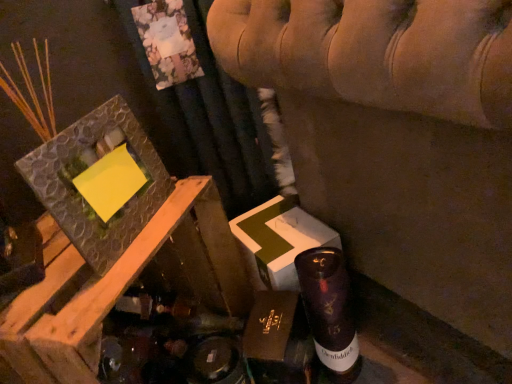
Measure the distance between point (x=48, y=179) and camera.

A distance of 22.09 inches exists between point (x=48, y=179) and camera.

Where is `textured stone picture frame at upper left`? This screenshot has height=384, width=512. textured stone picture frame at upper left is located at coordinates (79, 194).

From the image's perspective, which is below, textured stone picture frame at upper left or velvet beige sofa at upper center?

textured stone picture frame at upper left is shown below in the image.

Which is behind, textured stone picture frame at upper left or velvet beige sofa at upper center?

textured stone picture frame at upper left is more distant.

From the picture: Is textured stone picture frame at upper left at the left side of velvet beige sofa at upper center?

Indeed, textured stone picture frame at upper left is positioned on the left side of velvet beige sofa at upper center.

Consider the image. Who is shorter, textured stone picture frame at upper left or velvet beige sofa at upper center?

With less height is textured stone picture frame at upper left.

Consider the image. Can we say textured stone picture frame at upper left lies outside brown cardboard box at center?

Yes, textured stone picture frame at upper left is located beyond the bounds of brown cardboard box at center.

Is textured stone picture frame at upper left looking in the opposite direction of brown cardboard box at center?

No, textured stone picture frame at upper left is not facing the opposite direction of brown cardboard box at center.

From the image's perspective, which one is positioned lower, textured stone picture frame at upper left or brown cardboard box at center?

From the image's view, brown cardboard box at center is below.

Is textured stone picture frame at upper left to the left of brown cardboard box at center from the viewer's perspective?

Correct, you'll find textured stone picture frame at upper left to the left of brown cardboard box at center.

Measure the distance from shiny purple glass bottle at lower right to velvet beige sofa at upper center.

shiny purple glass bottle at lower right and velvet beige sofa at upper center are 9.40 inches apart from each other.

You are a GUI agent. You are given a task and a screenshot of the screen. Output one action in this format:
    pyautogui.click(x=<x>, y=<y>)
    Task: Click on the bottle behind the velvet beige sofa at upper center
    
    Given the screenshot: What is the action you would take?
    pyautogui.click(x=330, y=311)

Can you confirm if shiny purple glass bottle at lower right is wider than velvet beige sofa at upper center?

In fact, shiny purple glass bottle at lower right might be narrower than velvet beige sofa at upper center.

Does shiny purple glass bottle at lower right turn towards velvet beige sofa at upper center?

Yes, shiny purple glass bottle at lower right is facing velvet beige sofa at upper center.

Based on the photo, does velvet beige sofa at upper center lie in front of shiny purple glass bottle at lower right?

Yes.

Locate an element on the screen. bottle on the left of the velvet beige sofa at upper center is located at coordinates (330, 311).

Are velvet beige sofa at upper center and shiny purple glass bottle at lower right making contact?

velvet beige sofa at upper center is not next to shiny purple glass bottle at lower right, and they're not touching.

Do you think velvet beige sofa at upper center is within shiny purple glass bottle at lower right, or outside of it?

velvet beige sofa at upper center exists outside the volume of shiny purple glass bottle at lower right.

Could you tell me if velvet beige sofa at upper center is facing brown cardboard box at center?

No, velvet beige sofa at upper center does not turn towards brown cardboard box at center.

From the image's perspective, who appears lower, velvet beige sofa at upper center or brown cardboard box at center?

brown cardboard box at center, from the image's perspective.

Can you tell me how much velvet beige sofa at upper center and brown cardboard box at center differ in facing direction?

There is a 40.7-degree angle between the facing directions of velvet beige sofa at upper center and brown cardboard box at center.

Who is smaller, velvet beige sofa at upper center or brown cardboard box at center?

Smaller between the two is brown cardboard box at center.

Is brown cardboard box at center behind shiny purple glass bottle at lower right?

No, brown cardboard box at center is closer to the viewer.

Considering the relative positions of brown cardboard box at center and shiny purple glass bottle at lower right in the image provided, is brown cardboard box at center to the right of shiny purple glass bottle at lower right from the viewer's perspective?

No, brown cardboard box at center is not to the right of shiny purple glass bottle at lower right.

From the image's perspective, is brown cardboard box at center above or below shiny purple glass bottle at lower right?

Clearly, from the image's perspective, brown cardboard box at center is below shiny purple glass bottle at lower right.

Is brown cardboard box at center facing towards velvet beige sofa at upper center?

Yes.

Considering the sizes of objects brown cardboard box at center and velvet beige sofa at upper center in the image provided, who is shorter, brown cardboard box at center or velvet beige sofa at upper center?

With less height is brown cardboard box at center.

From a real-world perspective, which is physically above, brown cardboard box at center or velvet beige sofa at upper center?

velvet beige sofa at upper center, from a real-world perspective.

The width and height of the screenshot is (512, 384). What are the coordinates of `furniture above the textured stone picture frame at upper left (from the image's perspective)` in the screenshot? It's located at (396, 137).

You are a GUI agent. You are given a task and a screenshot of the screen. Output one action in this format:
    pyautogui.click(x=<x>, y=<y>)
    Task: Click on the picture frame to the left of brown cardboard box at center
    
    Given the screenshot: What is the action you would take?
    (79, 194)

Looking at the image, which one is located further to velvet beige sofa at upper center, brown cardboard box at center or textured stone picture frame at upper left?

The object further to velvet beige sofa at upper center is textured stone picture frame at upper left.

Consider the image. Considering their positions, is brown cardboard box at center positioned closer to textured stone picture frame at upper left than shiny purple glass bottle at lower right?

Based on the image, brown cardboard box at center appears to be nearer to textured stone picture frame at upper left.

Estimate the real-world distances between objects in this image. Which object is further from velvet beige sofa at upper center, shiny purple glass bottle at lower right or brown cardboard box at center?

Among the two, brown cardboard box at center is located further to velvet beige sofa at upper center.

When comparing their distances from shiny purple glass bottle at lower right, does velvet beige sofa at upper center or brown cardboard box at center seem further?

Among the two, velvet beige sofa at upper center is located further to shiny purple glass bottle at lower right.

Looking at the image, which one is located closer to brown cardboard box at center, shiny purple glass bottle at lower right or velvet beige sofa at upper center?

Among the two, shiny purple glass bottle at lower right is located nearer to brown cardboard box at center.

From the image, which object appears to be nearer to brown cardboard box at center, velvet beige sofa at upper center or textured stone picture frame at upper left?

velvet beige sofa at upper center lies closer to brown cardboard box at center than the other object.

Looking at this image, estimate the real-world distances between objects in this image. Which object is further from textured stone picture frame at upper left, velvet beige sofa at upper center or shiny purple glass bottle at lower right?

shiny purple glass bottle at lower right is further to textured stone picture frame at upper left.

Which object lies nearer to the anchor point textured stone picture frame at upper left, brown cardboard box at center or velvet beige sofa at upper center?

Based on the image, brown cardboard box at center appears to be nearer to textured stone picture frame at upper left.

Identify the location of bottle between textured stone picture frame at upper left and velvet beige sofa at upper center. (330, 311).

At what (x,y) coordinates should I click in order to perform the action: click on bottle between velvet beige sofa at upper center and brown cardboard box at center in the vertical direction. Please return your answer as a coordinate pair (x, y). This screenshot has width=512, height=384. Looking at the image, I should click on (330, 311).

You are a GUI agent. You are given a task and a screenshot of the screen. Output one action in this format:
    pyautogui.click(x=<x>, y=<y>)
    Task: Click on the cardboard box located between textured stone picture frame at upper left and velvet beige sofa at upper center in the left-right direction
    
    Given the screenshot: What is the action you would take?
    pyautogui.click(x=278, y=340)

Identify the location of cardboard box located between textured stone picture frame at upper left and shiny purple glass bottle at lower right in the left-right direction. (278, 340).